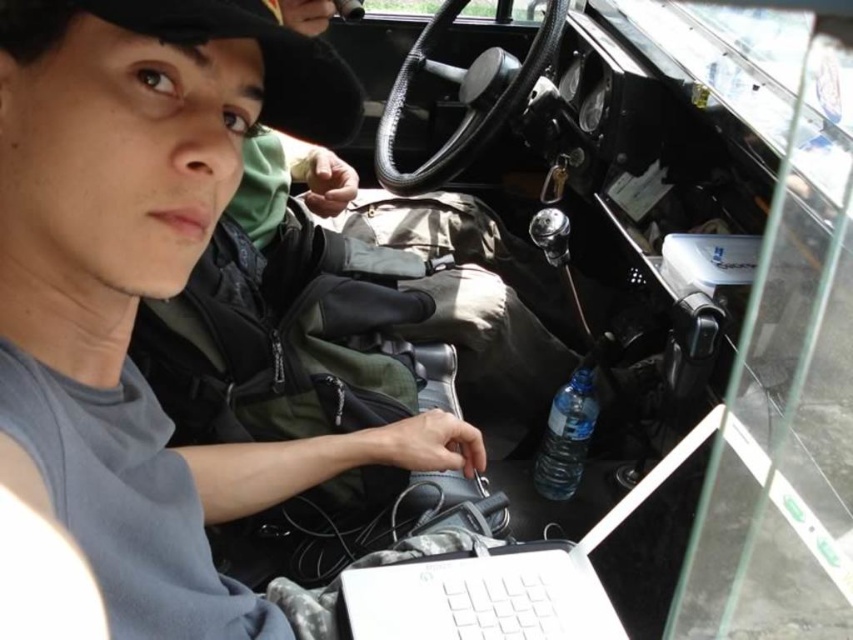
Can you confirm if white plastic laptop at center is positioned to the right of clear plastic bottle at lower right?

No, white plastic laptop at center is not to the right of clear plastic bottle at lower right.

Who is more distant from viewer, (413, 582) or (560, 422)?

Positioned behind is point (560, 422).

Where is `white plastic laptop at center`? The height and width of the screenshot is (640, 853). white plastic laptop at center is located at coordinates (505, 580).